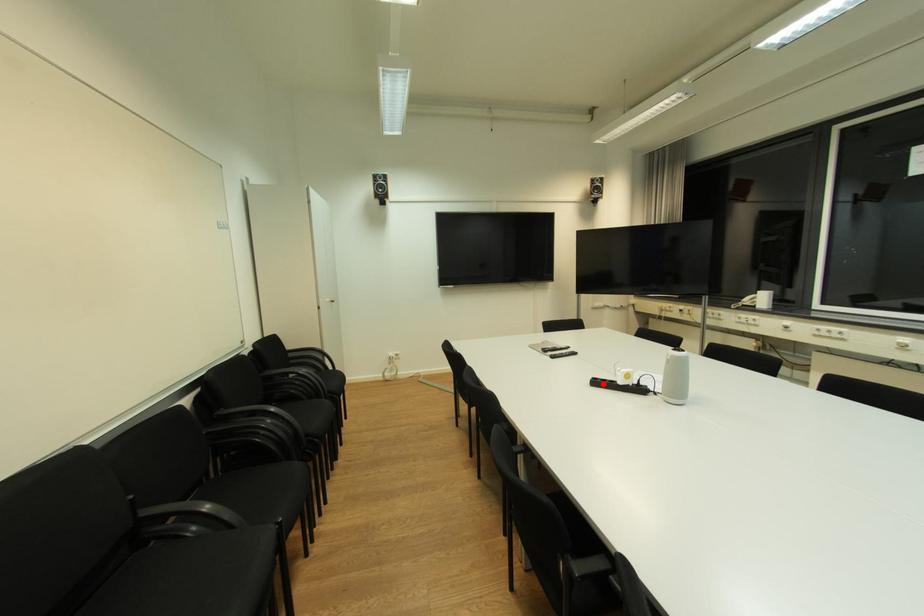
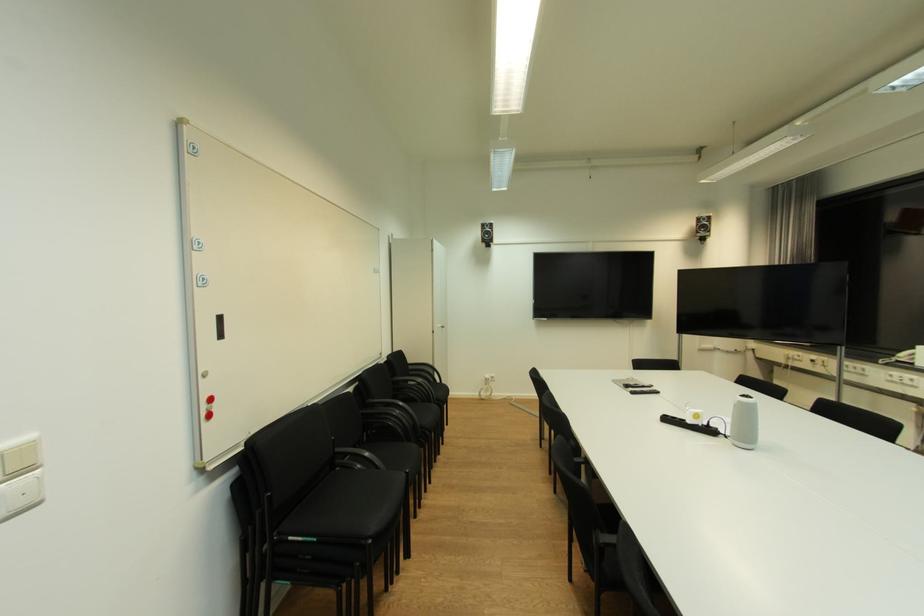
Find the pixel in the second image that matches the highlighted location in the first image.

(674, 421)